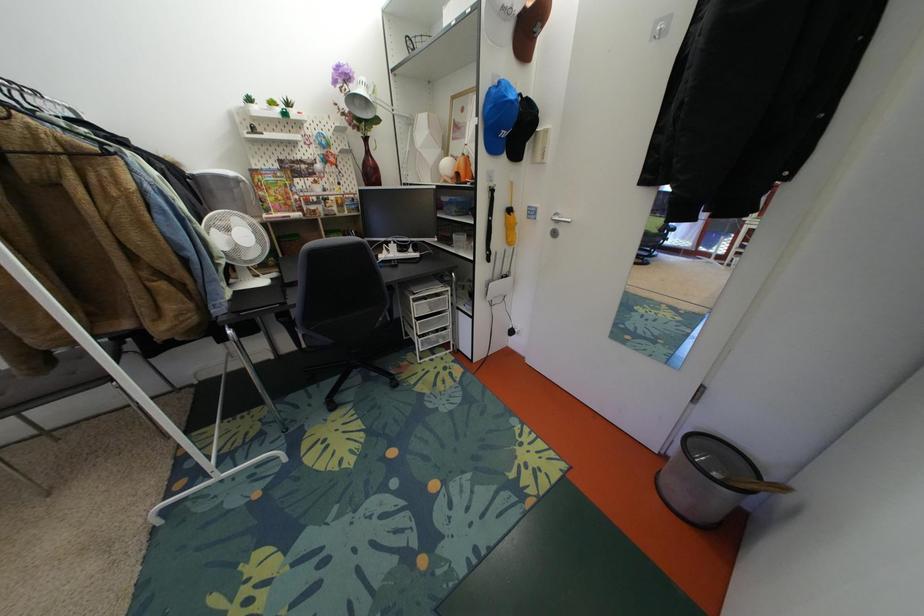
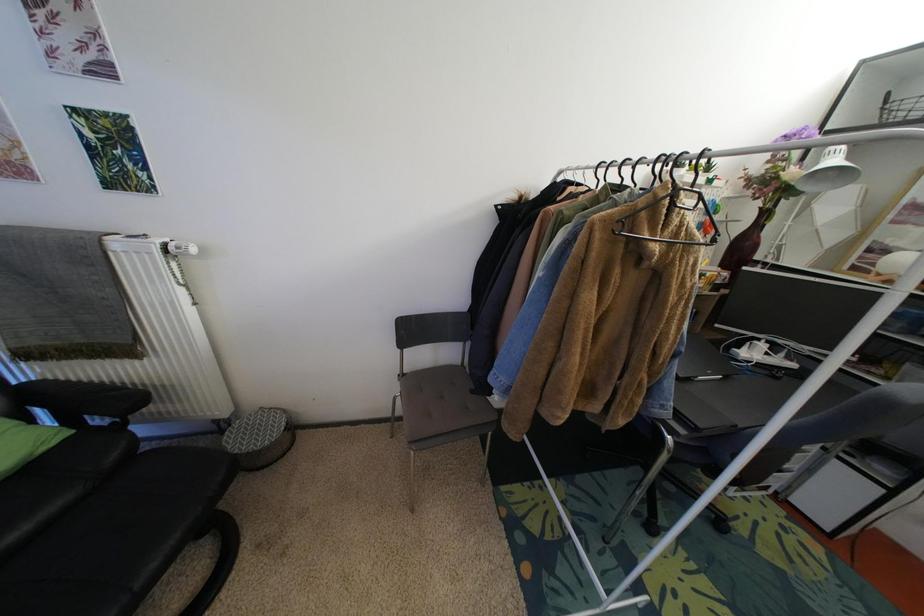
Question: Which direction would the cameraman need to move to produce the second image? Reply with the corresponding letter.

Choices:
 (A) Left
 (B) Right
 (C) Forward
 (D) Backward

Answer: (A)